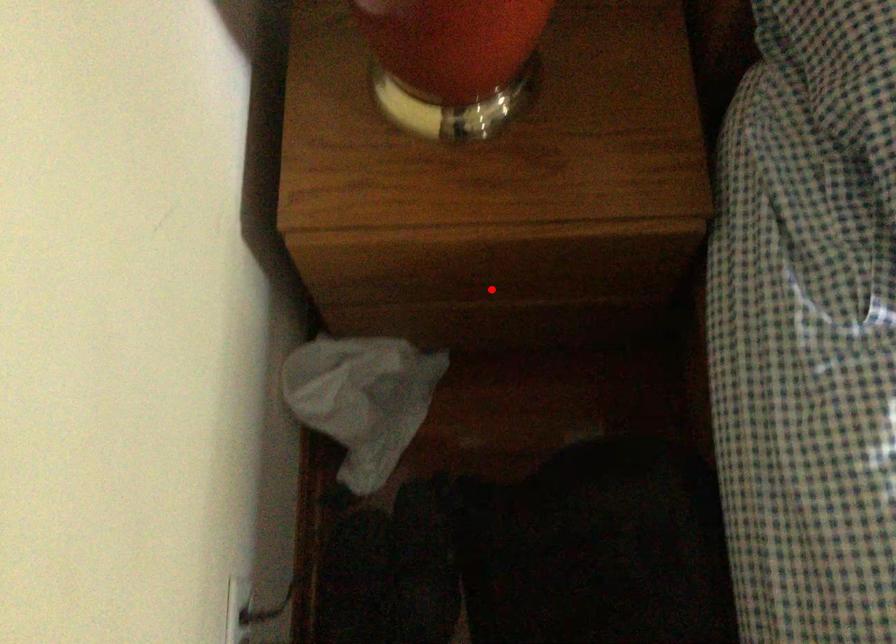
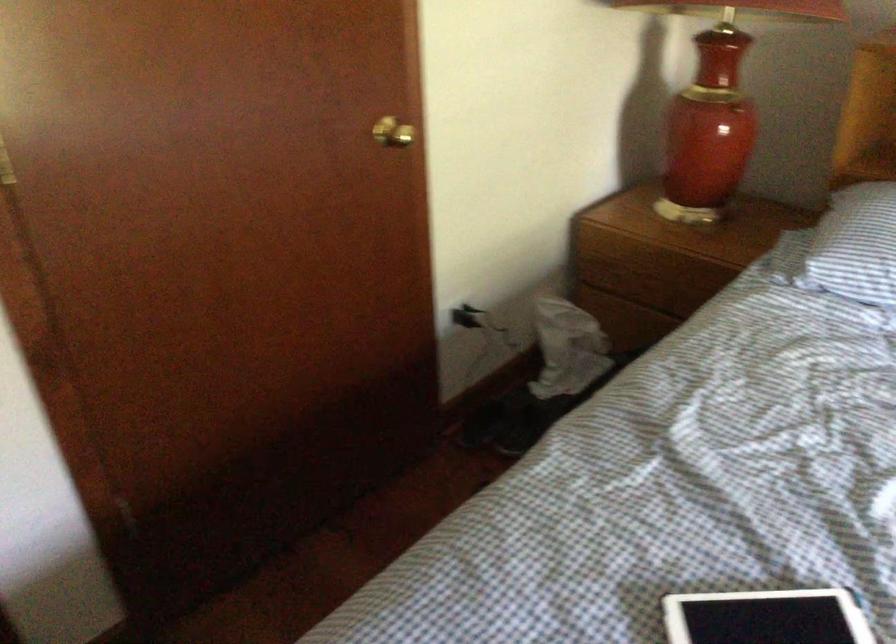
Question: I am providing you with two images of the same scene from different viewpoints. A red point is marked on the first image. Is the red point's position out of view in image 2?

Choices:
 (A) Yes
 (B) No

Answer: (B)